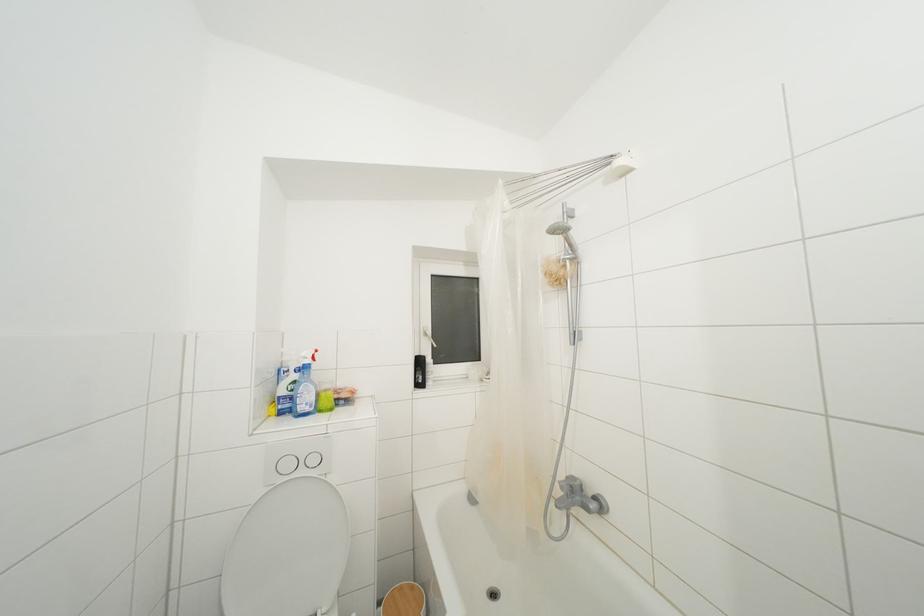
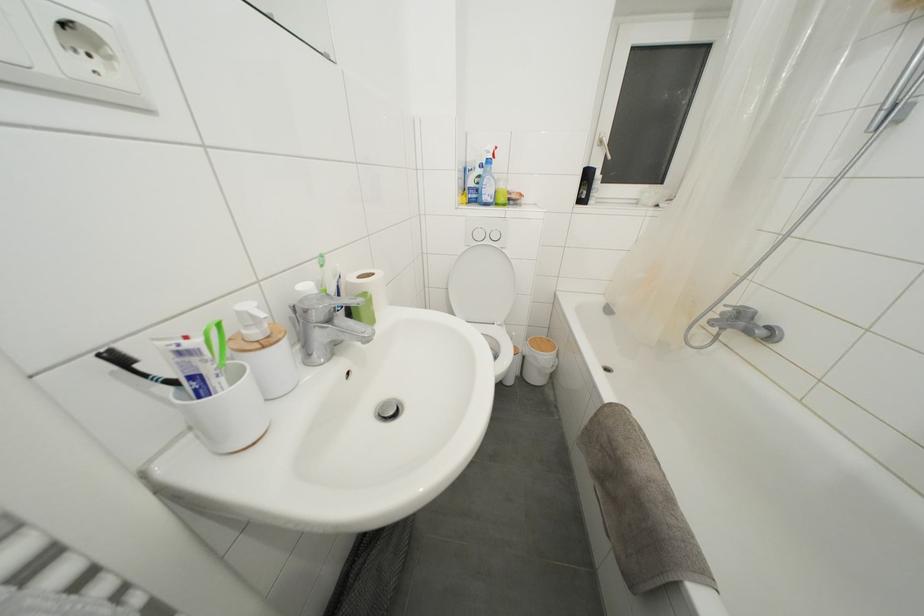
Find the pixel in the second image that matches (x=423, y=367) in the first image.

(591, 180)